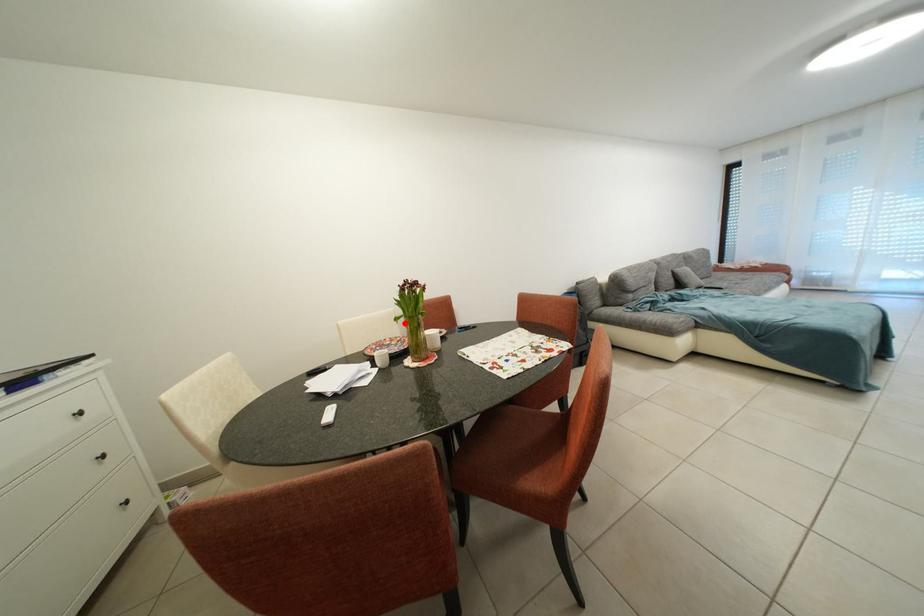
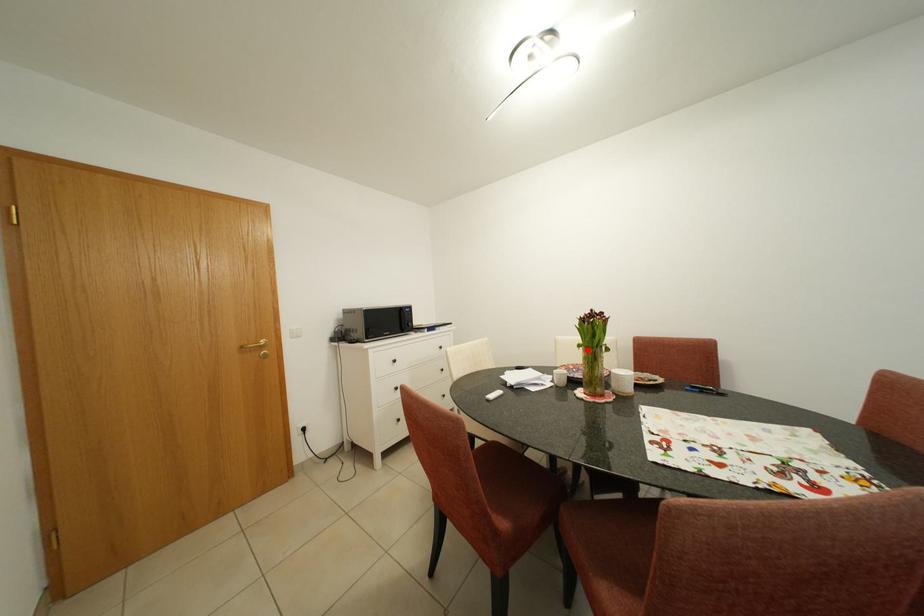
I am providing you with two images of the same scene from different viewpoints. A red point is marked on the first image and another point is marked on the second image. Is the red point in image1 aligned with the point shown in image2?

Yes